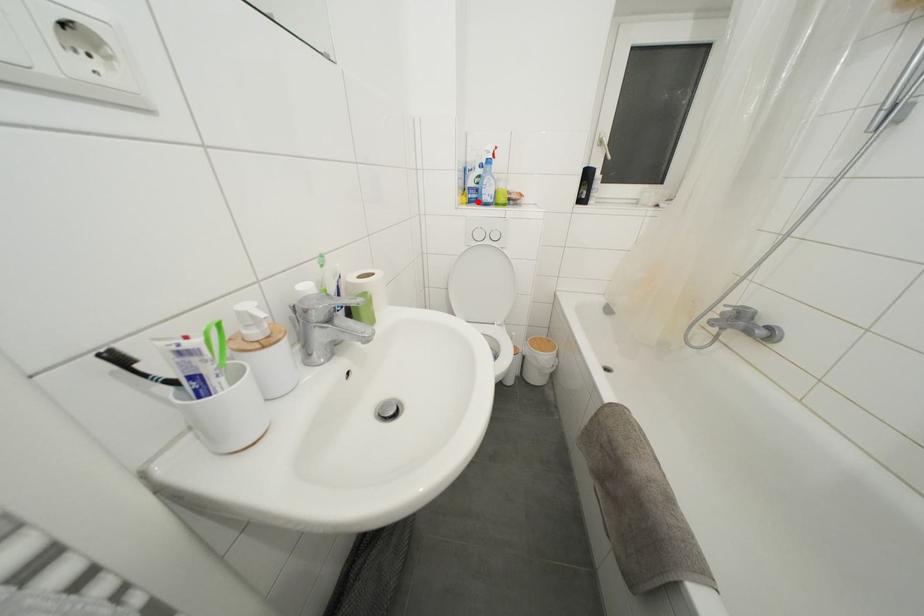
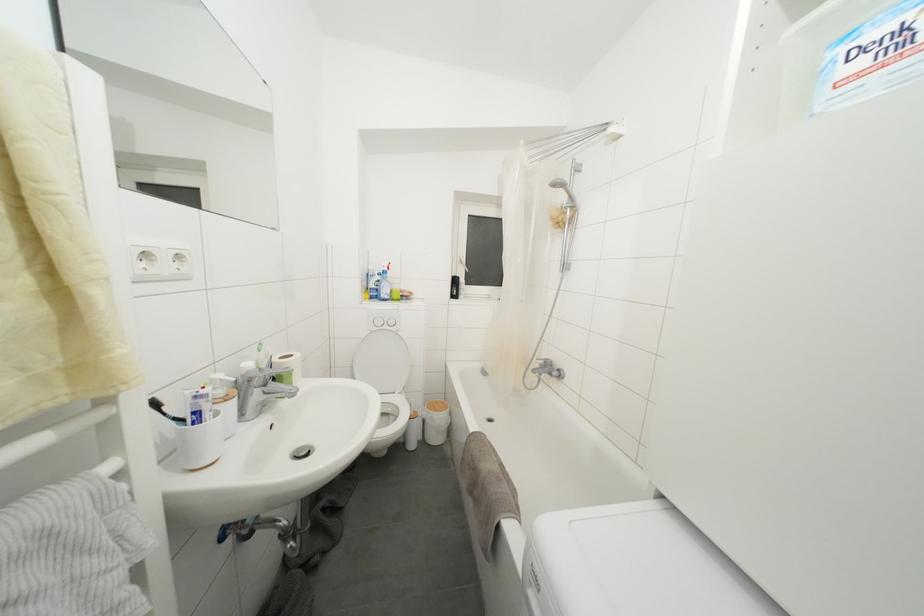
The point at the highlighted location is marked in the first image. Where is the corresponding point in the second image?

(379, 300)